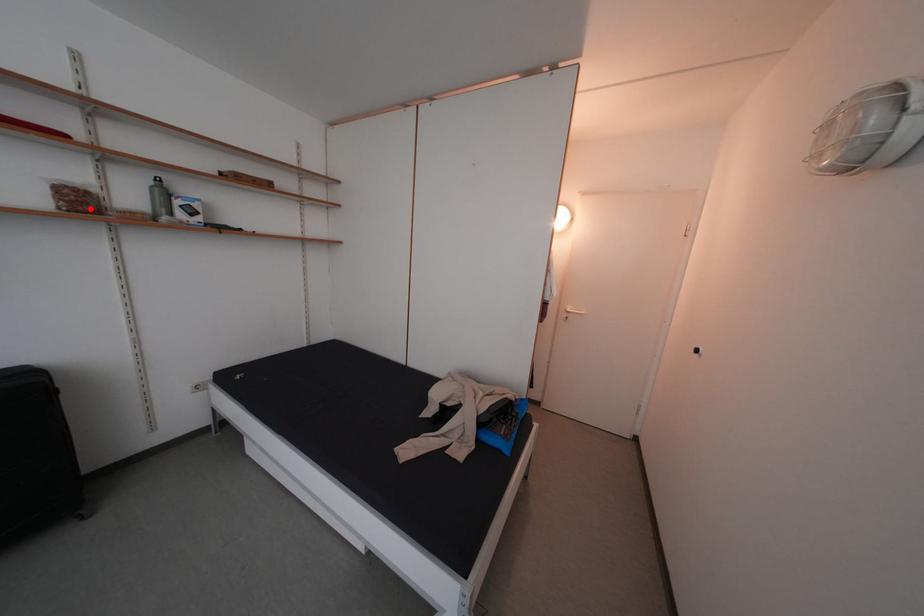
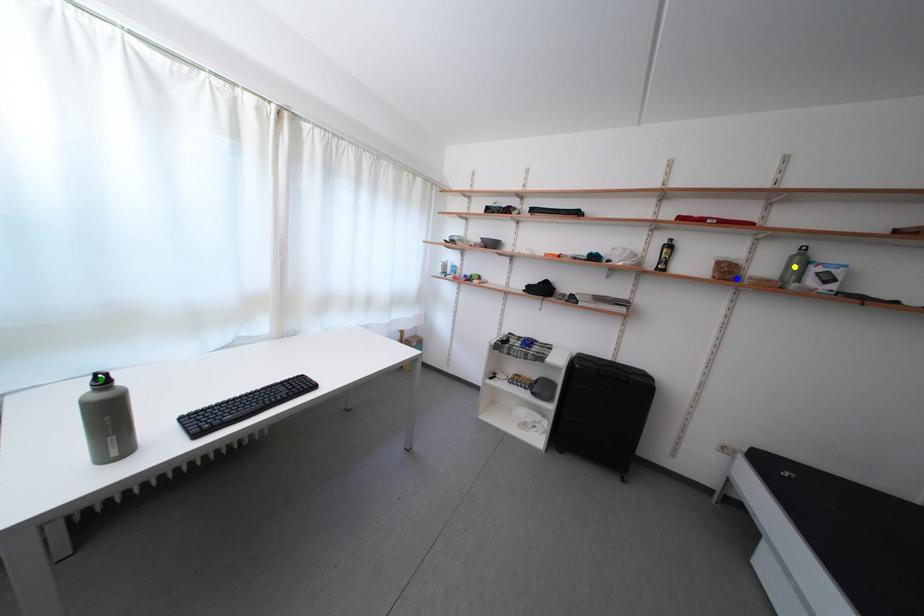
Question: I am providing you with two images of the same scene from different viewpoints. A red point is marked on the first image. You are given multiple points on the second image. Which mark in image 2 goes with the point in image 1?

Choices:
 (A) yellow point
 (B) green point
 (C) blue point

Answer: (C)